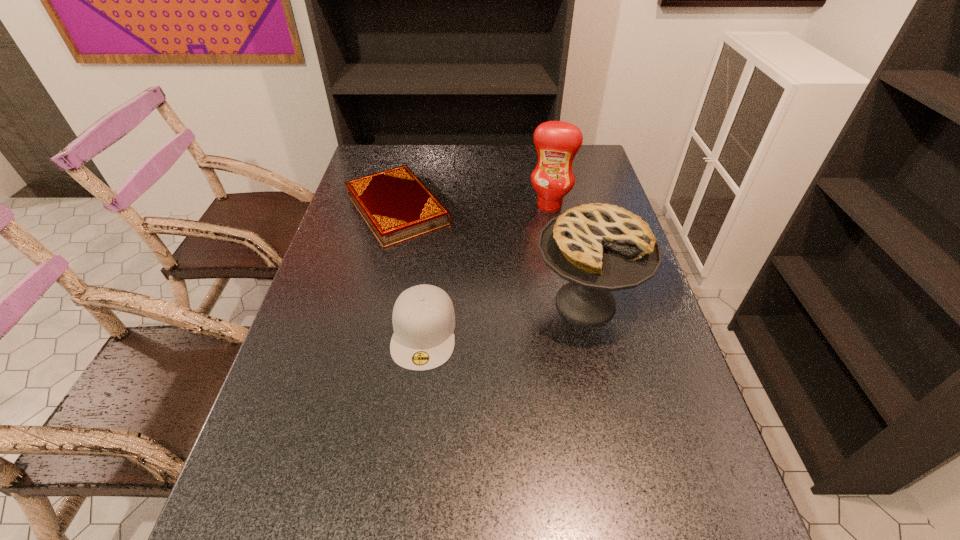
At what (x,y) coordinates should I click in order to perform the action: click on cap. Please return your answer as a coordinate pair (x, y). The width and height of the screenshot is (960, 540). Looking at the image, I should click on (423, 318).

At what (x,y) coordinates should I click in order to perform the action: click on pie. Please return your answer as a coordinate pair (x, y). This screenshot has width=960, height=540. Looking at the image, I should click on (599, 248).

At what (x,y) coordinates should I click in order to perform the action: click on the shortest object. Please return your answer as a coordinate pair (x, y). Looking at the image, I should click on (395, 204).

In order to click on condiment in this screenshot , I will do `click(557, 143)`.

Find the location of a particular element. free spot located on the front-facing side of the second shortest object is located at coordinates (410, 454).

Identify the location of free spot located 0.090m on the cut side of the pie. This screenshot has width=960, height=540. (603, 380).

The image size is (960, 540). What are the coordinates of `free spot located 0.100m on the cover of the shortest object` in the screenshot? It's located at (436, 261).

Identify the location of vacant area situated 0.360m on the cover of the shortest object. (482, 321).

The image size is (960, 540). In order to click on free point located on the cover of the shortest object in this screenshot , I will do `click(474, 311)`.

This screenshot has height=540, width=960. Identify the location of vacant space situated on the label side of the condiment. (540, 232).